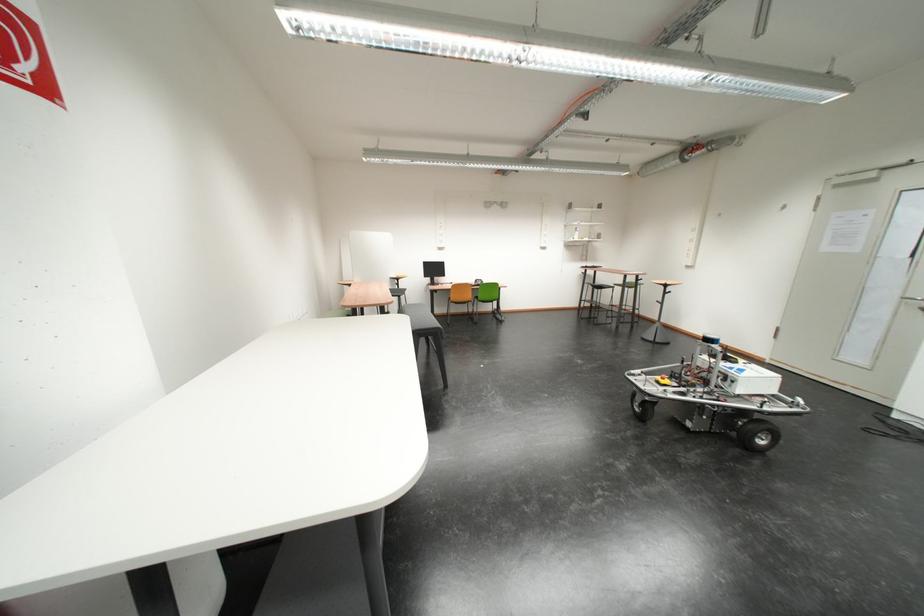
Where is `white door handle`? The image size is (924, 616). white door handle is located at coordinates (915, 301).